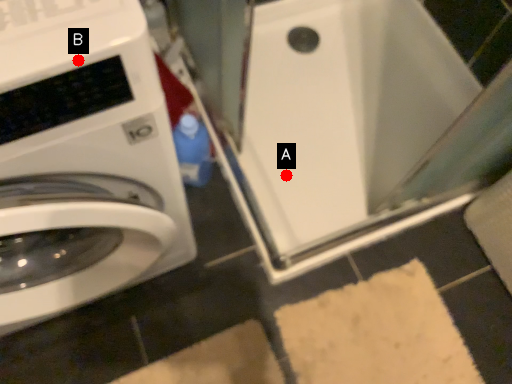
Question: Two points are circled on the image, labeled by A and B beside each circle. Which point is closer to the camera taking this photo?

Choices:
 (A) A is closer
 (B) B is closer

Answer: (B)